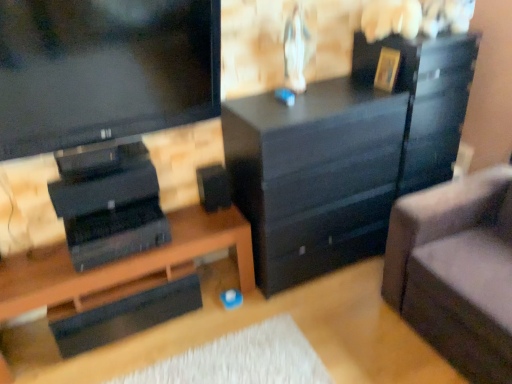
I want to click on vacant area that is in front of black matte chest of drawers at center, so click(x=335, y=324).